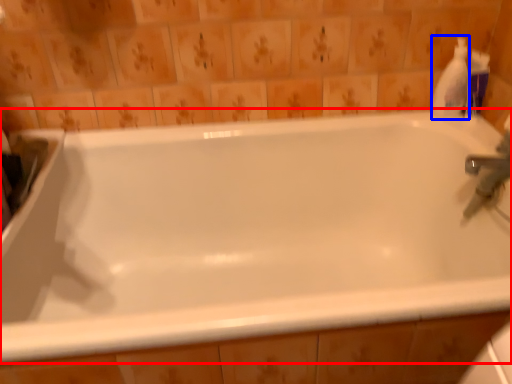
Question: Which of the following is the closest to the observer, bathtub (highlighted by a red box) or cleaning product (highlighted by a blue box)?

Choices:
 (A) bathtub
 (B) cleaning product

Answer: (A)